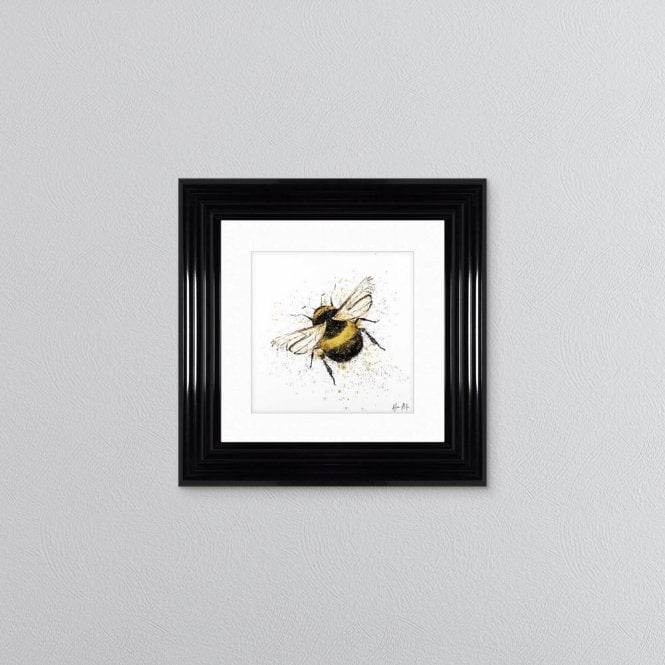
The height and width of the screenshot is (665, 665). What are the coordinates of `light reflecting on black picture frame` in the screenshot? It's located at (194, 348), (479, 340).